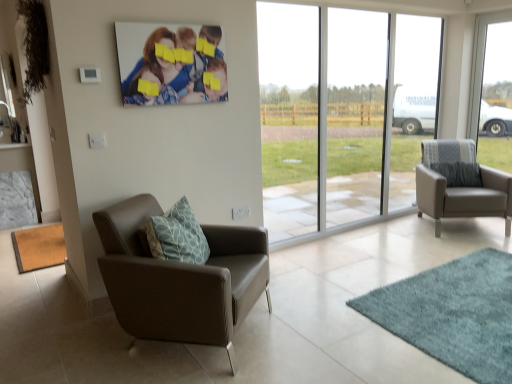
Question: From the image's perspective, relative to brown matte mat at lower left, which appears as the first mat when viewed from the left, is transparent glass window at right, which is counted as the 1th window, starting from the right, above or below?

Choices:
 (A) above
 (B) below

Answer: (A)

Question: Considering their positions, is transparent glass window at right, the 2th window from the left, located in front of or behind brown matte mat at lower left, which appears as the first mat when viewed from the left?

Choices:
 (A) front
 (B) behind

Answer: (B)

Question: Which is farther from the matte gray armchair at right, the 1th chair from the back?

Choices:
 (A) brown leather chair at left, the first chair positioned from the front
 (B) teal shaggy rug at lower right, which is the 2th mat in left-to-right order
 (C) transparent glass window at center, which appears as the first window when viewed from the left
 (D) brown matte mat at lower left, the second mat viewed from the right
 (E) transparent glass window at right, the 2th window from the left

Answer: (D)

Question: Based on their relative distances, which object is nearer to the brown matte mat at lower left, which appears as the first mat when viewed from the left?

Choices:
 (A) white plastic power outlet at lower center
 (B) brown leather chair at left, the first chair positioned from the front
 (C) teal shaggy rug at lower right, placed as the first mat when sorted from right to left
 (D) transparent glass window at right, which is counted as the 1th window, starting from the right
 (E) matte gray armchair at right, the 2th chair from the front

Answer: (B)